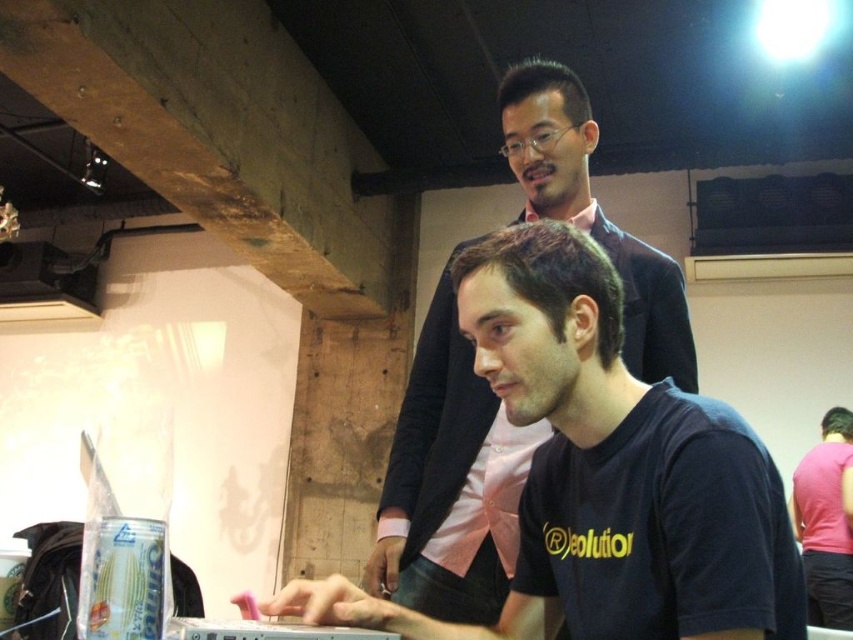
Question: Estimate the real-world distances between objects in this image. Which object is farther from the black matte shirt at center?

Choices:
 (A) pink fabric shirt at center
 (B) pink satin shirt at upper center

Answer: (A)

Question: Which point is farther from the camera taking this photo?

Choices:
 (A) (563, 432)
 (B) (804, 570)
 (C) (386, 500)

Answer: (B)

Question: Which point is closer to the camera?

Choices:
 (A) black matte shirt at center
 (B) pink satin shirt at upper center

Answer: (A)

Question: Considering the relative positions of black matte shirt at center and pink fabric shirt at center in the image provided, where is black matte shirt at center located with respect to pink fabric shirt at center?

Choices:
 (A) right
 (B) left

Answer: (B)

Question: Is black matte shirt at center further to camera compared to pink satin shirt at upper center?

Choices:
 (A) yes
 (B) no

Answer: (B)

Question: Does black matte shirt at center have a lesser width compared to pink fabric shirt at center?

Choices:
 (A) no
 (B) yes

Answer: (A)